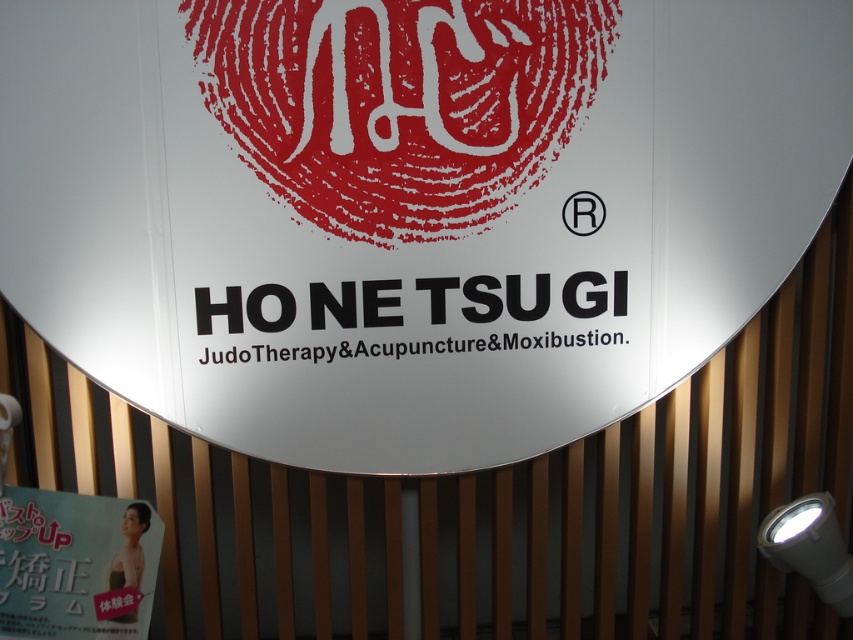
You are standing in front of the circular signboard and notice two elements. One is the white glossy poster at lower left and the other is the black registered trademark symbol at upper center. Which one is positioned to the left of the other?

The white glossy poster at lower left is to the left of the black registered trademark symbol at upper center.